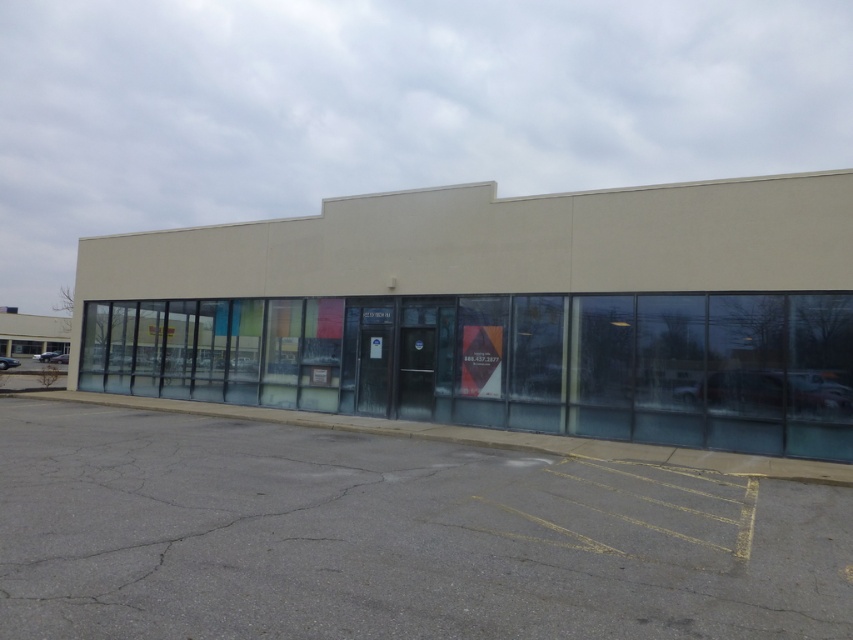
You are standing in front of the beige concrete building at center and want to walk to the gray asphalt parking lot at lower center. Which direction should you move to reach the parking lot?

Since the beige concrete building at center is closer to you than the gray asphalt parking lot at lower center, you should move forward away from the building to reach the parking lot.

You are standing in front of the beige concrete building at center and want to walk to the gray asphalt parking lot at lower center. In which direction should you head relative to the building?

The beige concrete building at center is to the left of the gray asphalt parking lot at lower center, so you should head to the right to reach the parking lot.

You are a delivery driver approaching the beige concrete building at center and the gray asphalt parking lot at lower center. Which object is located higher in the image?

The beige concrete building at center is positioned over the gray asphalt parking lot at lower center, so it is higher in the image.